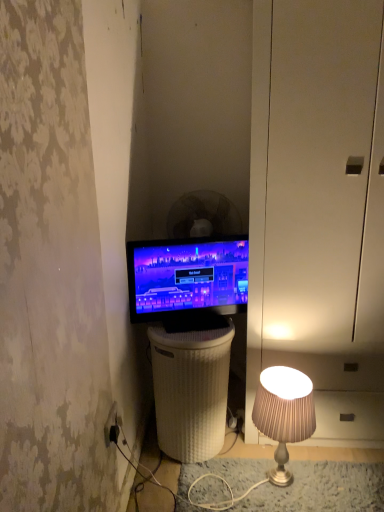
Question: Should I look upward or downward to see black plastic mechanical fan at center?

Choices:
 (A) down
 (B) up

Answer: (B)

Question: Does white glossy dresser at right appear on the left side of black plastic mechanical fan at center?

Choices:
 (A) no
 (B) yes

Answer: (A)

Question: Is black plastic mechanical fan at center located within white glossy dresser at right?

Choices:
 (A) no
 (B) yes

Answer: (A)

Question: Is white glossy dresser at right located outside black plastic mechanical fan at center?

Choices:
 (A) yes
 (B) no

Answer: (A)

Question: Is white glossy dresser at right turned away from black plastic mechanical fan at center?

Choices:
 (A) no
 (B) yes

Answer: (A)

Question: Is white glossy dresser at right touching black plastic mechanical fan at center?

Choices:
 (A) yes
 (B) no

Answer: (B)

Question: From a real-world perspective, is white glossy dresser at right physically below black plastic mechanical fan at center?

Choices:
 (A) no
 (B) yes

Answer: (B)

Question: Can you confirm if black plastic mechanical fan at center is bigger than white glossy dresser at right?

Choices:
 (A) no
 (B) yes

Answer: (A)

Question: Considering the relative sizes of black plastic mechanical fan at center and white glossy dresser at right in the image provided, is black plastic mechanical fan at center shorter than white glossy dresser at right?

Choices:
 (A) yes
 (B) no

Answer: (A)

Question: Does black plastic mechanical fan at center turn towards white glossy dresser at right?

Choices:
 (A) yes
 (B) no

Answer: (A)

Question: From the image's perspective, is black plastic mechanical fan at center beneath white glossy dresser at right?

Choices:
 (A) no
 (B) yes

Answer: (A)

Question: Does black plastic mechanical fan at center appear on the left side of white glossy dresser at right?

Choices:
 (A) yes
 (B) no

Answer: (A)

Question: From the image's perspective, is black plastic mechanical fan at center on white glossy dresser at right?

Choices:
 (A) no
 (B) yes

Answer: (B)

Question: From their relative heights in the image, would you say black plastic mechanical fan at center is taller or shorter than white glossy dresser at right?

Choices:
 (A) tall
 (B) short

Answer: (B)